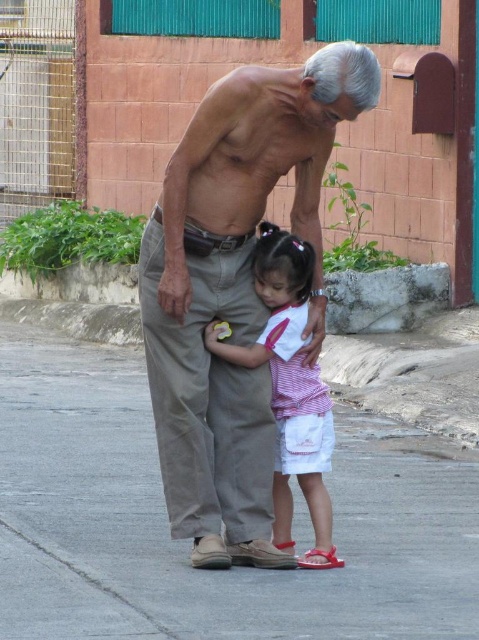
You are a delivery person carrying a box that measures 3 feet in length. You need to place it on the gray concrete pavement at center without overlapping the striped cotton shirt at center. Is there enough space between them to do this?

The distance between the gray concrete pavement at center and striped cotton shirt at center is 3.41 feet. Since the box is 3 feet long, there is enough space to place it on the gray concrete pavement at center without overlapping the striped cotton shirt at center.